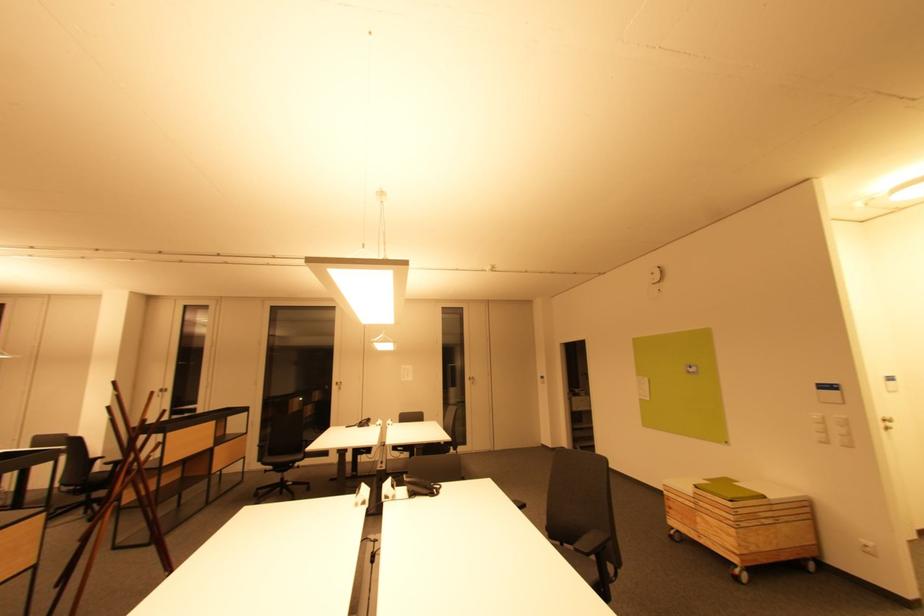
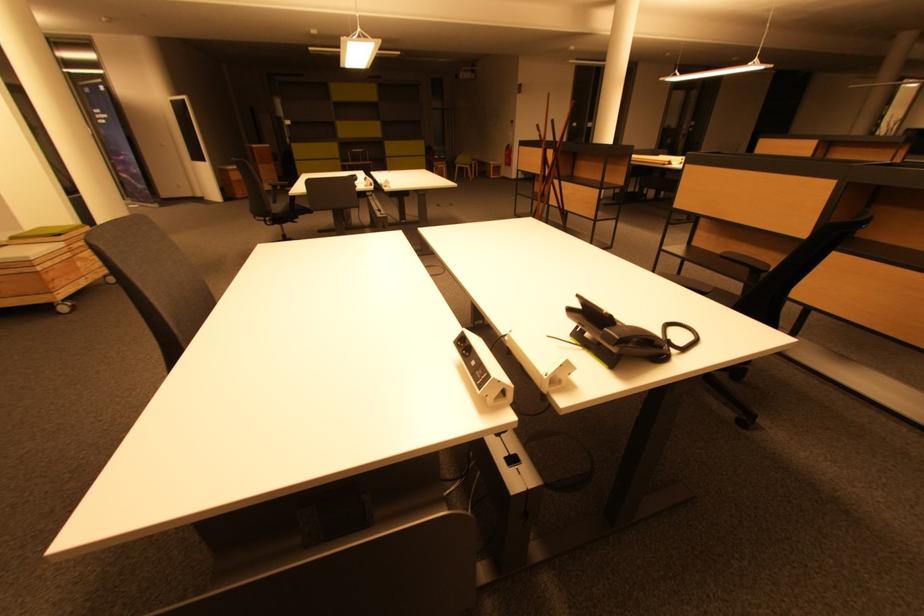
In the second image, find the point that corresponds to (x=703, y=522) in the first image.

(83, 265)